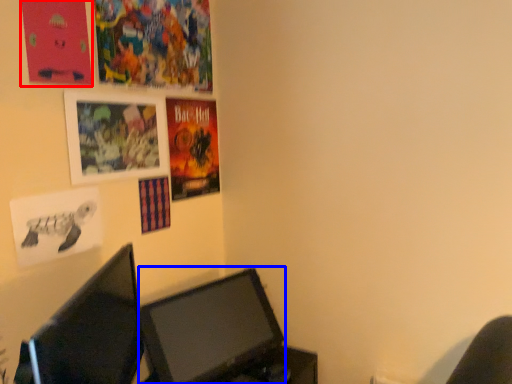
Question: Which of the following is the closest to the observer, poster page (highlighted by a red box) or computer monitor (highlighted by a blue box)?

Choices:
 (A) poster page
 (B) computer monitor

Answer: (A)